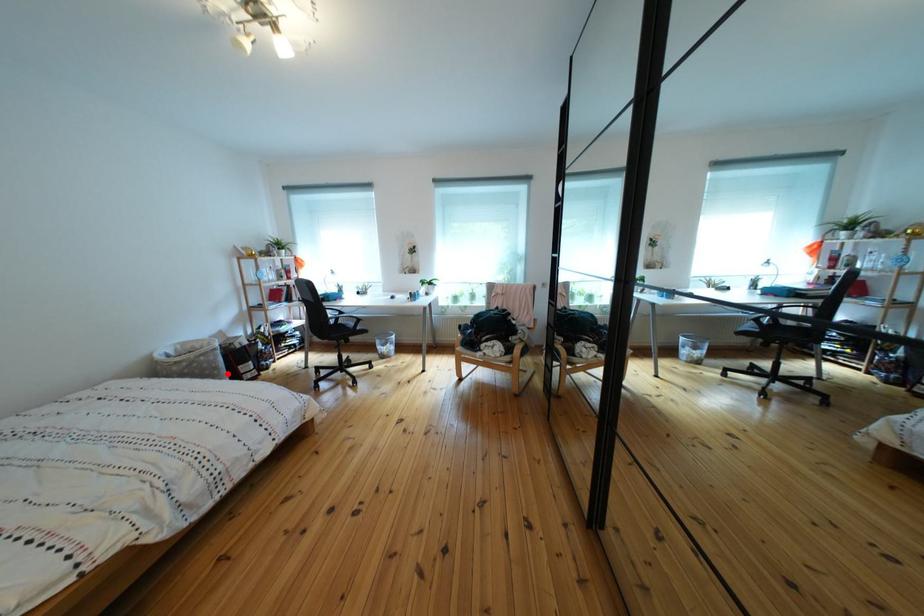
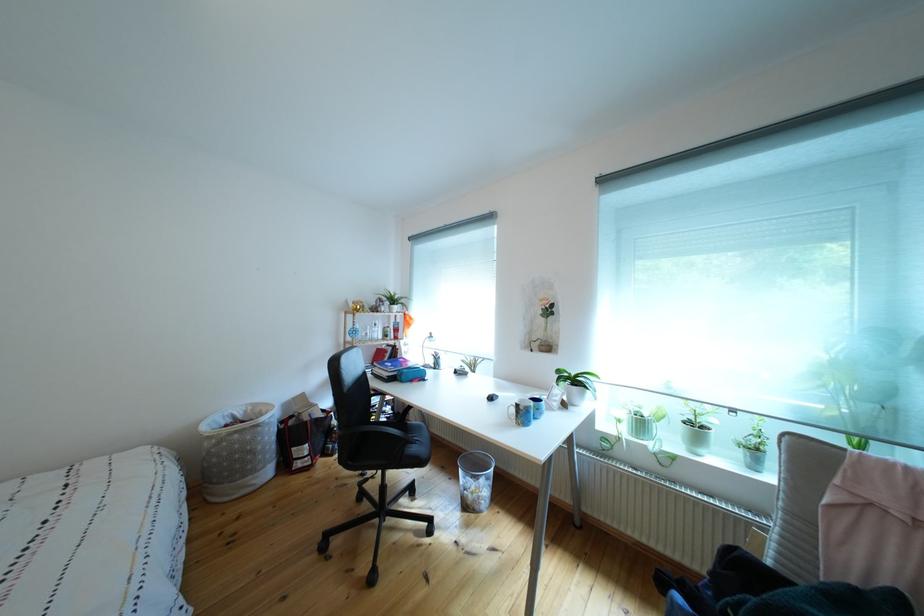
Find the pixel in the second image that matches the highlighted location in the first image.

(263, 456)